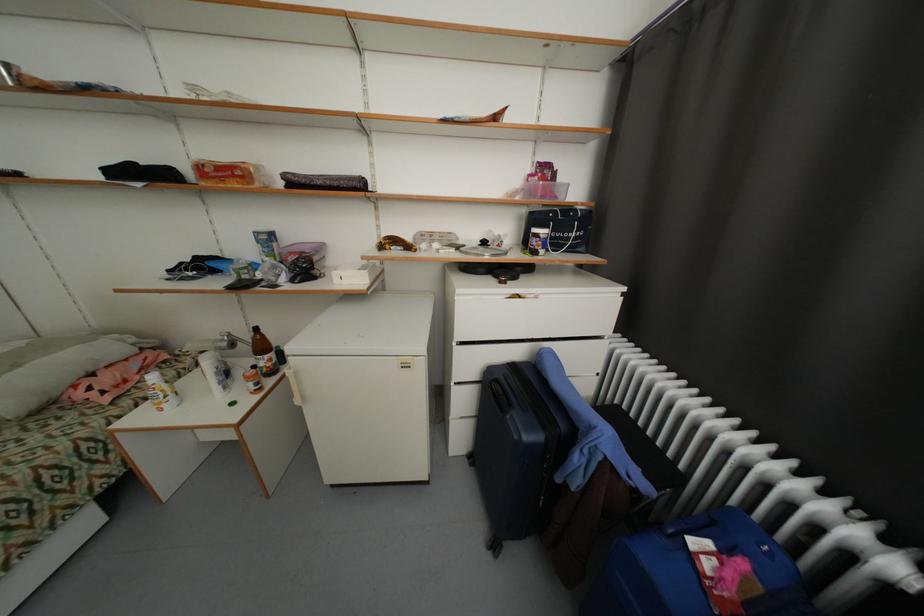
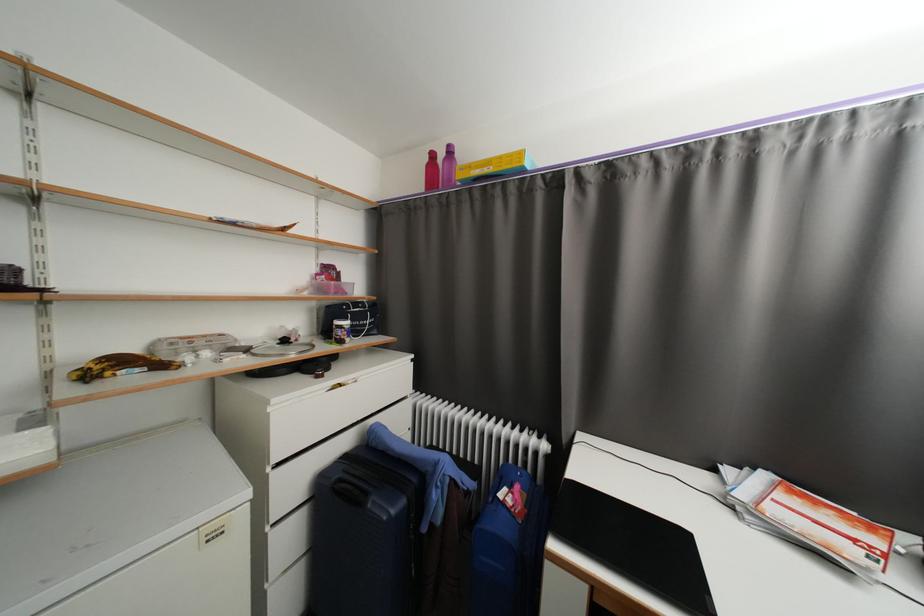
In the second image, find the point that corresponds to pixel 504 382 in the first image.

(346, 482)